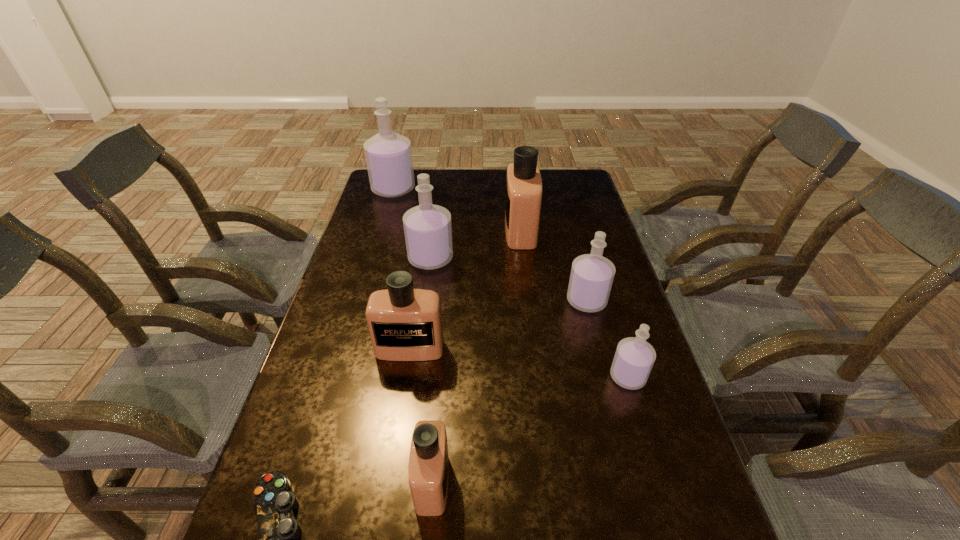
Where is `the nearest beige perfume`? The image size is (960, 540). the nearest beige perfume is located at coordinates (428, 468).

This screenshot has height=540, width=960. I want to click on the nearest perfume, so coord(428,468).

The height and width of the screenshot is (540, 960). Identify the location of the sixth farthest perfume. (634, 357).

Where is `the nearest purple perfume`? The image size is (960, 540). the nearest purple perfume is located at coordinates (634, 357).

Identify the location of free space located 0.050m on the right of the leftmost purple perfume. The width and height of the screenshot is (960, 540). 428,189.

This screenshot has height=540, width=960. I want to click on vacant area situated on the front label of the third object from right to left, so click(x=459, y=231).

Where is `vacant point located on the front label of the third object from right to left`? The height and width of the screenshot is (540, 960). vacant point located on the front label of the third object from right to left is located at coordinates (482, 231).

Identify the location of vacant space located on the front label of the third object from right to left. (402, 231).

At what (x,y) coordinates should I click in order to perform the action: click on free space located 0.060m on the front of the second purple perfume from left to right. Please return your answer as a coordinate pair (x, y). Looking at the image, I should click on (427, 286).

Locate an element on the screen. free point located on the back of the fourth nearest perfume is located at coordinates (566, 224).